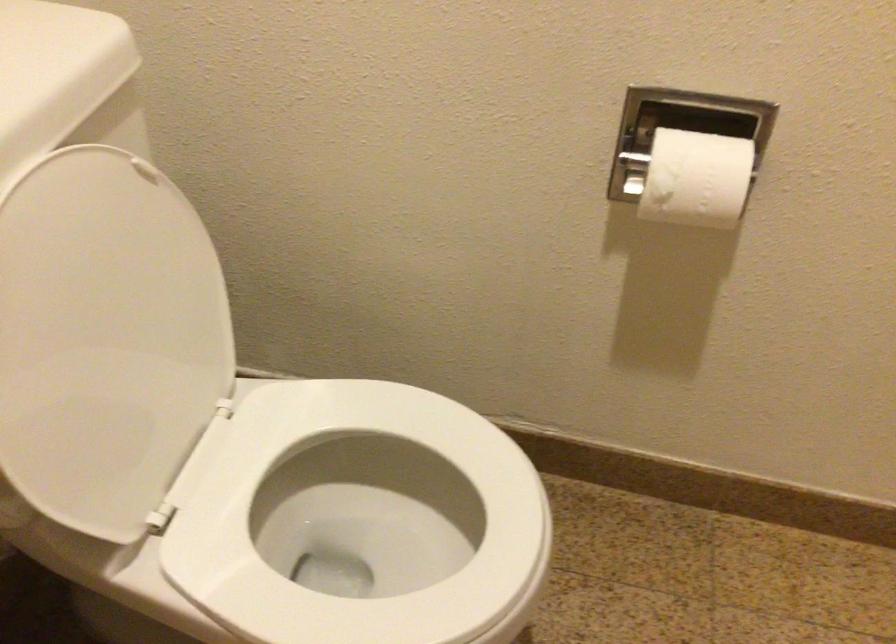
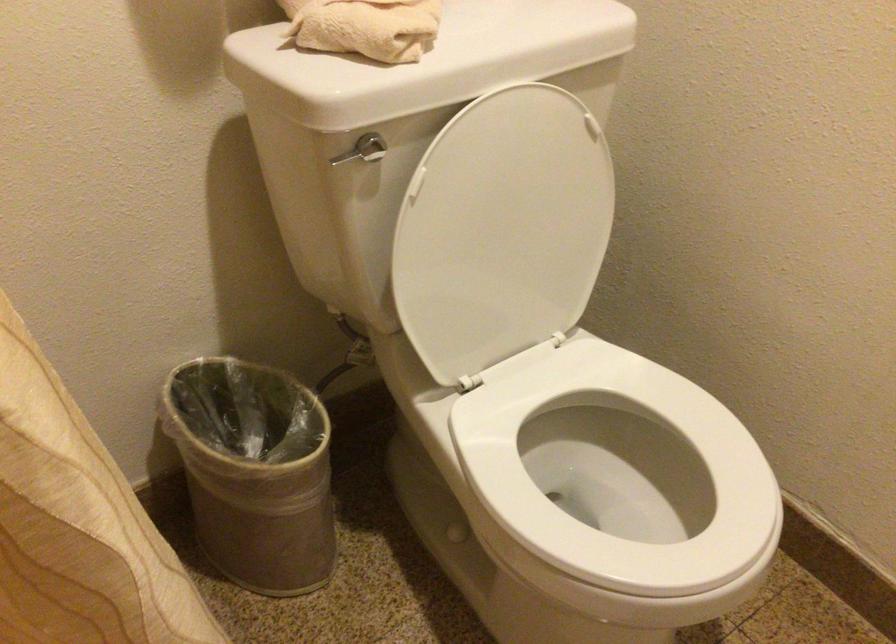
Where in the second image is the point corresponding to (x=110, y=337) from the first image?

(502, 230)